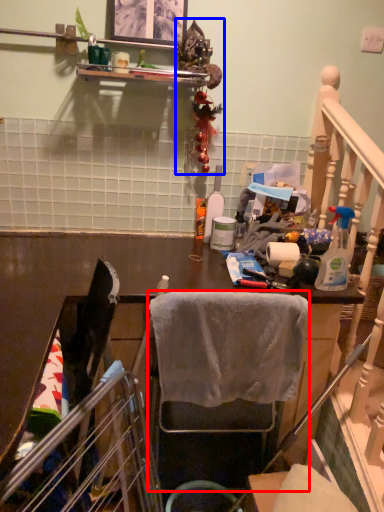
Question: Among these objects, which one is nearest to the camera, chair (highlighted by a red box) or christmas decoration (highlighted by a blue box)?

Choices:
 (A) chair
 (B) christmas decoration

Answer: (A)